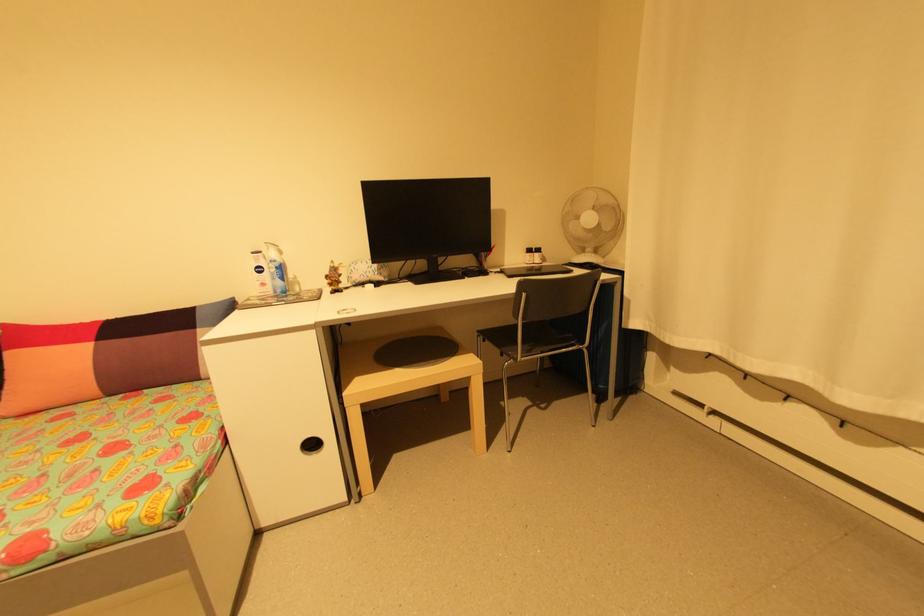
Find where to sit the chair sitting surface. Please return your answer as a coordinate pair (x, y).

(543, 328)